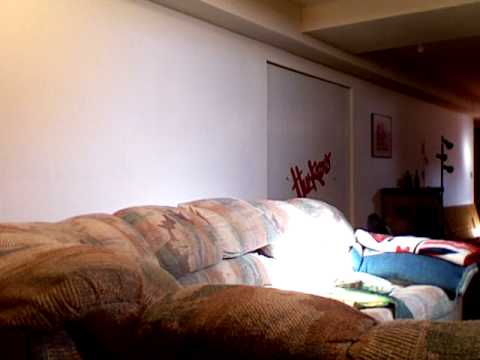
You are a GUI agent. You are given a task and a screenshot of the screen. Output one action in this format:
    pyautogui.click(x=<x>, y=<y>)
    Task: Click on the couch cushion
    This screenshot has height=360, width=480.
    Given the screenshot: What is the action you would take?
    coord(427,306)